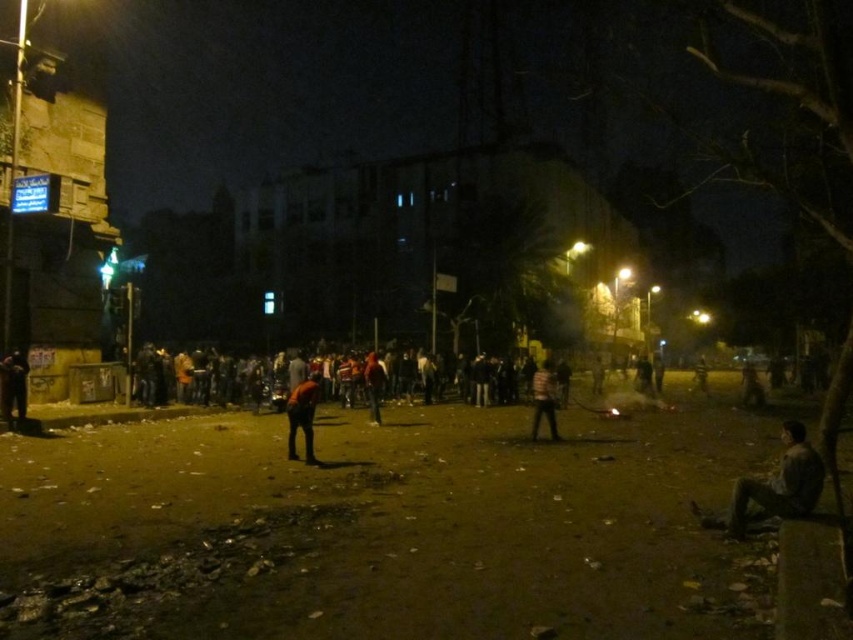
You are a drone operator trying to capture a clear image of two specific points in this nighttime scene. The points are labeled as point 1 at coordinates point (0, 397) and point 2 at coordinates point (378, 378). Given that you want to focus on the point that is nearest to the camera, which coordinate should you prioritize for your shot?

Point (0, 397) is closer to the camera than point (378, 378), so you should prioritize focusing on point (0, 397) for your shot.

You are a delivery robot navigating through this nighttime urban area. You need to deliver a package to the striped shirt at center. There is a camouflage fabric person at lower right blocking your path. Can you go around them without getting too close?

The camouflage fabric person at lower right is in front of striped shirt at center, so you can go around them by moving to the side since they are blocking the direct path.